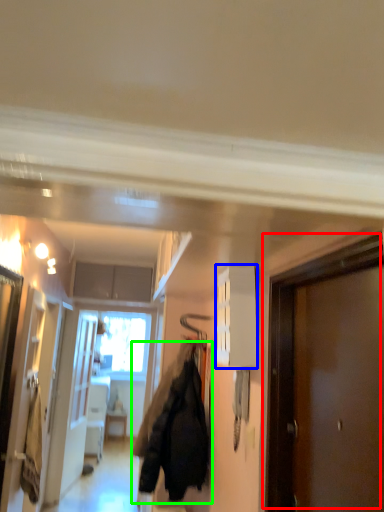
Question: Which is nearer to the door (highlighted by a red box)? cabinetry (highlighted by a blue box) or jacket (highlighted by a green box).

Choices:
 (A) cabinetry
 (B) jacket

Answer: (A)